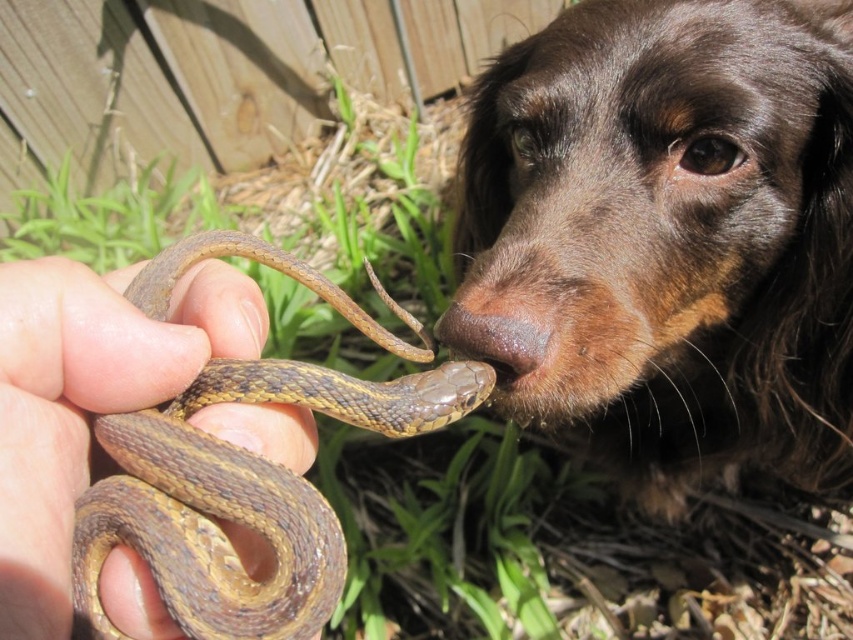
Question: Observing the image, what is the correct spatial positioning of brown fur dog at center in reference to brown matte nose at center?

Choices:
 (A) right
 (B) left

Answer: (A)

Question: Which of these objects is positioned farthest from the brown matte nose at center?

Choices:
 (A) brown fur dog at center
 (B) brown/scaly snake at center

Answer: (A)

Question: Among these objects, which one is nearest to the camera?

Choices:
 (A) brown/scaly snake at center
 (B) brown matte nose at center
 (C) brown fur dog at center

Answer: (A)

Question: Can you confirm if brown fur dog at center is wider than brown/scaly snake at center?

Choices:
 (A) yes
 (B) no

Answer: (A)

Question: Among these objects, which one is nearest to the camera?

Choices:
 (A) brown fur dog at center
 (B) brown matte nose at center

Answer: (B)

Question: Where is brown/scaly snake at center located in relation to brown matte nose at center in the image?

Choices:
 (A) below
 (B) above

Answer: (A)